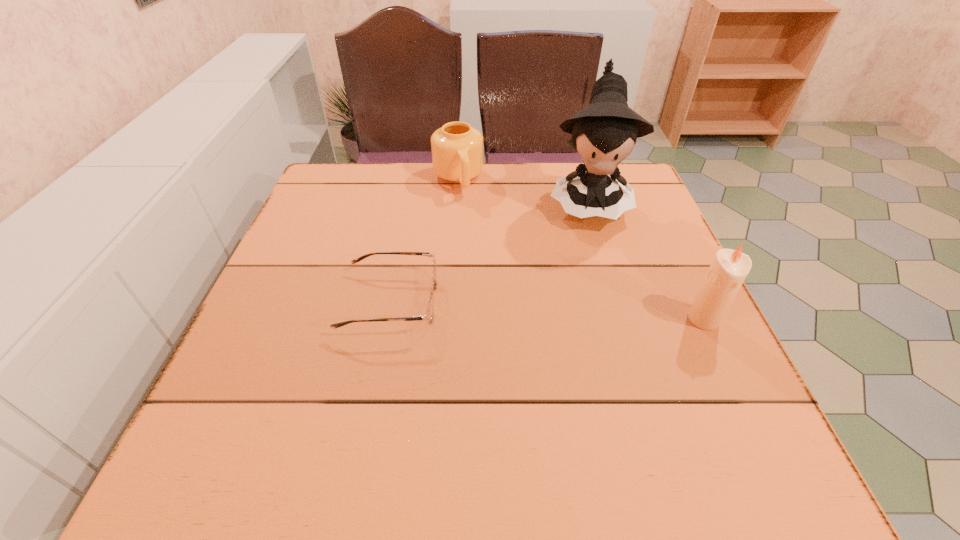
This screenshot has height=540, width=960. Identify the location of vacant space on the desktop that is between the spectacles and the rightmost object and is positioned at the face of the doll. (590, 313).

Find the location of a particular element. This screenshot has width=960, height=540. vacant space on the desktop that is between the spectacles and the candle and is positioned on the handle side of the mug is located at coordinates (503, 308).